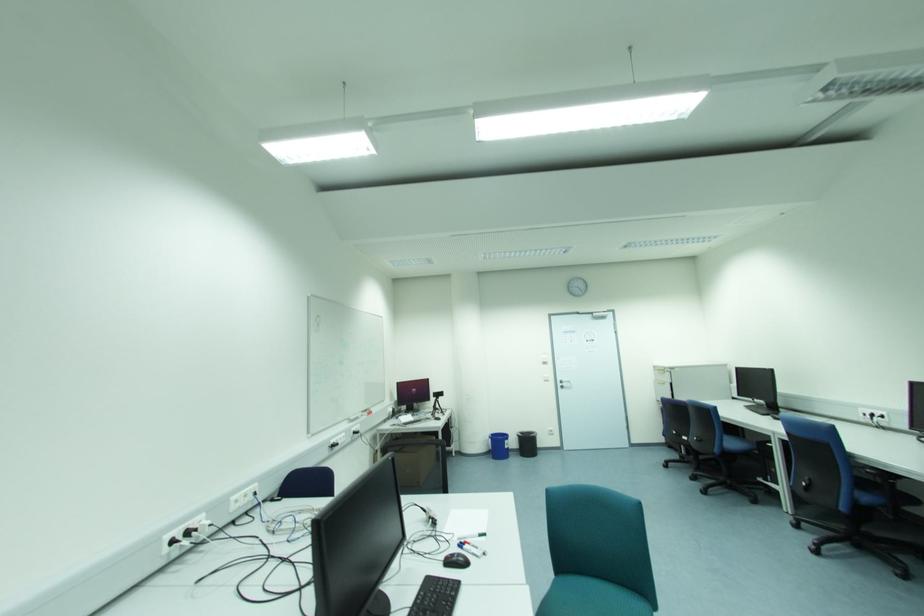
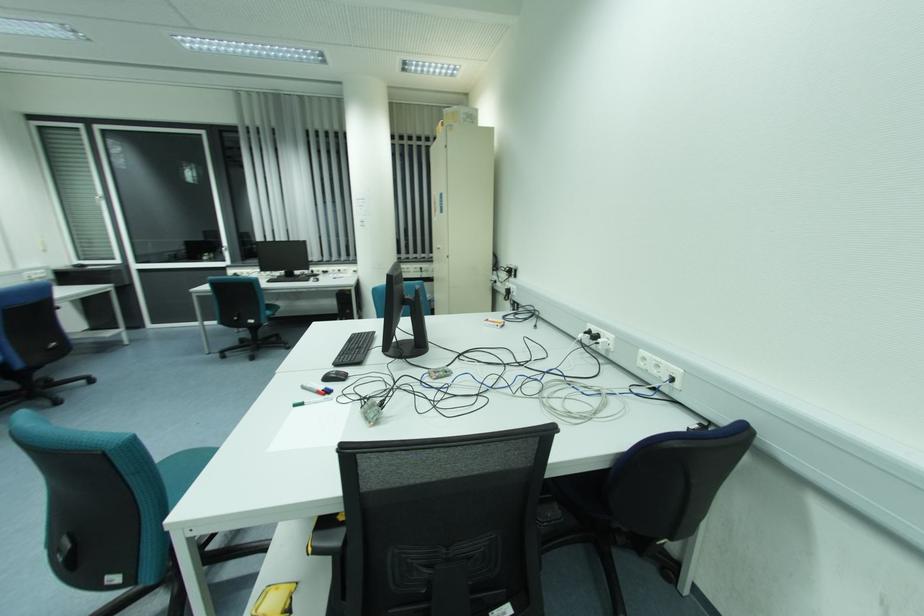
Where in the second image is the point corresponding to pixel 235 498 from the first image?

(642, 352)